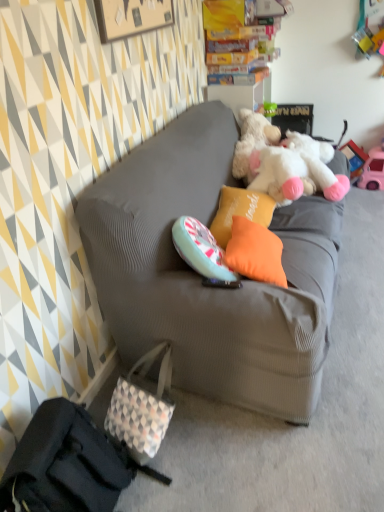
Question: Is white checkered fabric handbag at lower left, which appears as the first handbag when viewed from the front, in front of or behind white fluffy teddy bear at upper right in the image?

Choices:
 (A) behind
 (B) front

Answer: (B)

Question: Is white checkered fabric handbag at lower left, which appears as the first handbag when viewed from the front, bigger or smaller than white fluffy teddy bear at upper right?

Choices:
 (A) small
 (B) big

Answer: (A)

Question: Which is nearer to the white checkered fabric handbag at lower left, the 2th handbag viewed from the front?

Choices:
 (A) pink plastic toy car at right
 (B) orange fabric pillow at center, the 1th pillow viewed from the back
 (C) white checkered fabric handbag at lower left, the second handbag positioned from the back
 (D) gray fabric couch at center
 (E) white fluffy teddy bear at upper right

Answer: (C)

Question: Which is nearer to the white fluffy teddy bear at upper right?

Choices:
 (A) white checkered fabric handbag at lower left, the second handbag positioned from the back
 (B) white checkered fabric handbag at lower left, the 2th handbag viewed from the front
 (C) orange fabric pillow at center, the first pillow in the front-to-back sequence
 (D) pink plastic toy car at right
 (E) orange fabric pillow at center, placed as the second pillow when sorted from front to back

Answer: (E)